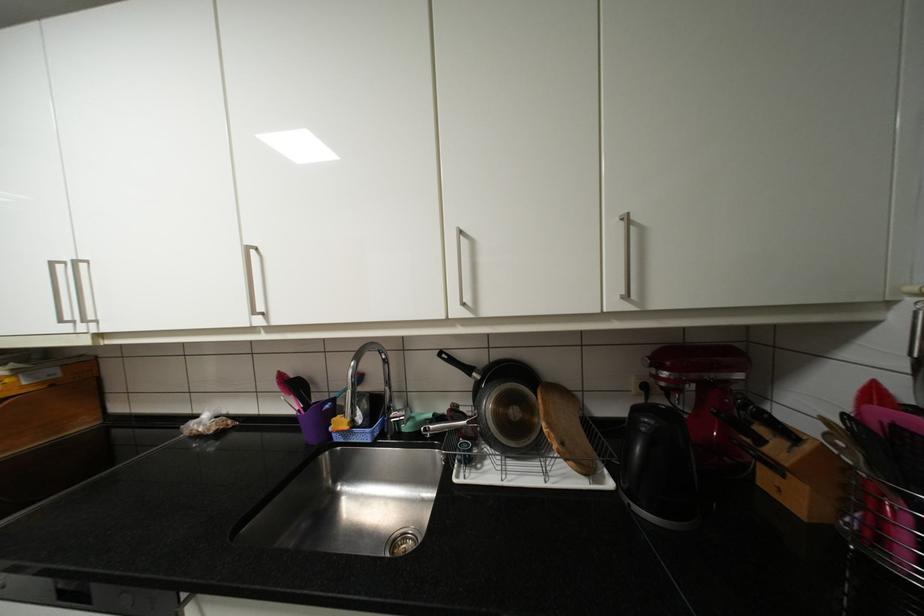
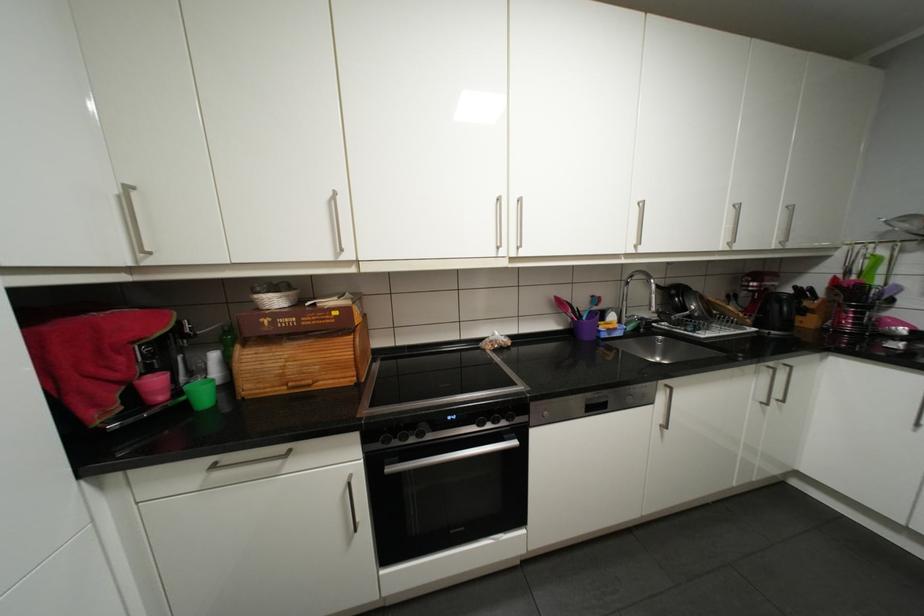
Question: The images are taken continuously from a first-person perspective. In which direction are you moving?

Choices:
 (A) Left
 (B) Right
 (C) Forward
 (D) Backward

Answer: (A)